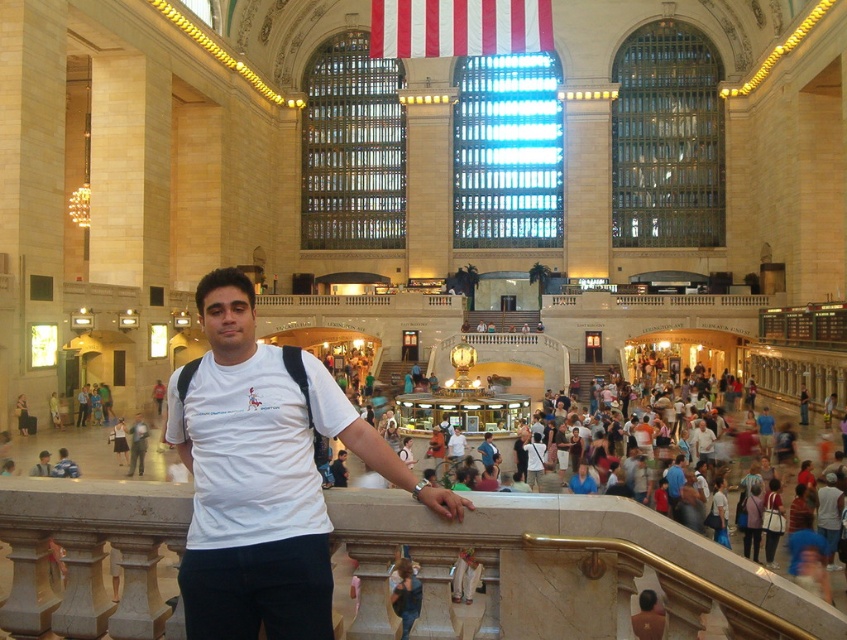
Question: Which object is farther from the camera taking this photo?

Choices:
 (A) white t-shirt at center
 (B) white striped fabric at upper center

Answer: (B)

Question: Which object appears farthest from the camera in this image?

Choices:
 (A) white t-shirt at center
 (B) white striped fabric at upper center

Answer: (B)

Question: Can you confirm if white t-shirt at center is positioned to the right of white striped fabric at upper center?

Choices:
 (A) no
 (B) yes

Answer: (A)

Question: Is white t-shirt at center below white striped fabric at upper center?

Choices:
 (A) no
 (B) yes

Answer: (B)

Question: Can you confirm if white t-shirt at center is thinner than white striped fabric at upper center?

Choices:
 (A) yes
 (B) no

Answer: (B)